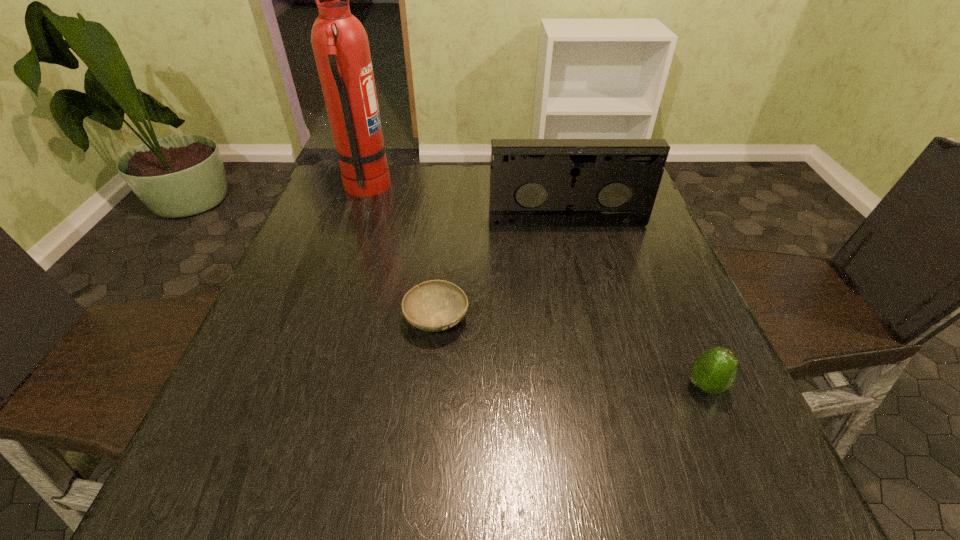
Image resolution: width=960 pixels, height=540 pixels. What are the coordinates of `the farthest object` in the screenshot? It's located at (340, 44).

Locate an element on the screen. the tallest object is located at coordinates (340, 44).

Locate an element on the screen. The width and height of the screenshot is (960, 540). videotape is located at coordinates (533, 182).

You are a GUI agent. You are given a task and a screenshot of the screen. Output one action in this format:
    pyautogui.click(x=<x>, y=<y>)
    Task: Click on the third shortest object
    This screenshot has width=960, height=540.
    Given the screenshot: What is the action you would take?
    pyautogui.click(x=533, y=182)

The height and width of the screenshot is (540, 960). In order to click on avocado in this screenshot , I will do `click(714, 371)`.

Where is `the nearest object`? The width and height of the screenshot is (960, 540). the nearest object is located at coordinates (714, 371).

Locate an element on the screen. The image size is (960, 540). the third object from right to left is located at coordinates (436, 305).

Find the location of a particular element. Image resolution: width=960 pixels, height=540 pixels. the shortest object is located at coordinates (436, 305).

At what (x,y) coordinates should I click in order to perform the action: click on vacant space located on the label side of the fire extinguisher. Please return your answer as a coordinate pair (x, y). The height and width of the screenshot is (540, 960). Looking at the image, I should click on (464, 188).

You are a GUI agent. You are given a task and a screenshot of the screen. Output one action in this format:
    pyautogui.click(x=<x>, y=<y>)
    Task: Click on the vacant space located 0.370m on the front side of the third shortest object
    The width and height of the screenshot is (960, 540).
    Given the screenshot: What is the action you would take?
    pyautogui.click(x=596, y=341)